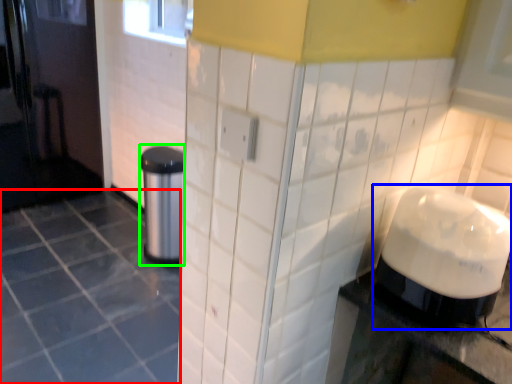
Question: Which object is positioned farthest from ceramic tile (highlighted by a red box)? Select from blender (highlighted by a blue box) and appliance (highlighted by a green box).

Choices:
 (A) blender
 (B) appliance

Answer: (A)